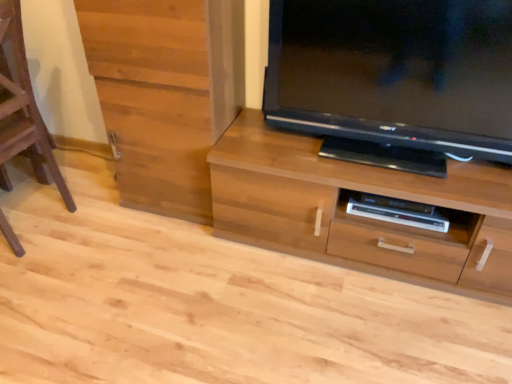
Question: Based on their positions, is brown wooden stool at left located to the left or right of black glossy television at upper right?

Choices:
 (A) right
 (B) left

Answer: (B)

Question: Is point (2, 230) positioned closer to the camera than point (451, 48)?

Choices:
 (A) farther
 (B) closer

Answer: (A)

Question: Which is nearer to the black glossy television at upper right?

Choices:
 (A) brown wooden stool at left
 (B) wooden cabinet at left
 (C) satin wood shelf at lower center
 (D) wooden chest of drawers at center

Answer: (D)

Question: Which object is the farthest from the brown wooden stool at left?

Choices:
 (A) wooden cabinet at left
 (B) wooden chest of drawers at center
 (C) satin wood shelf at lower center
 (D) black glossy television at upper right

Answer: (C)